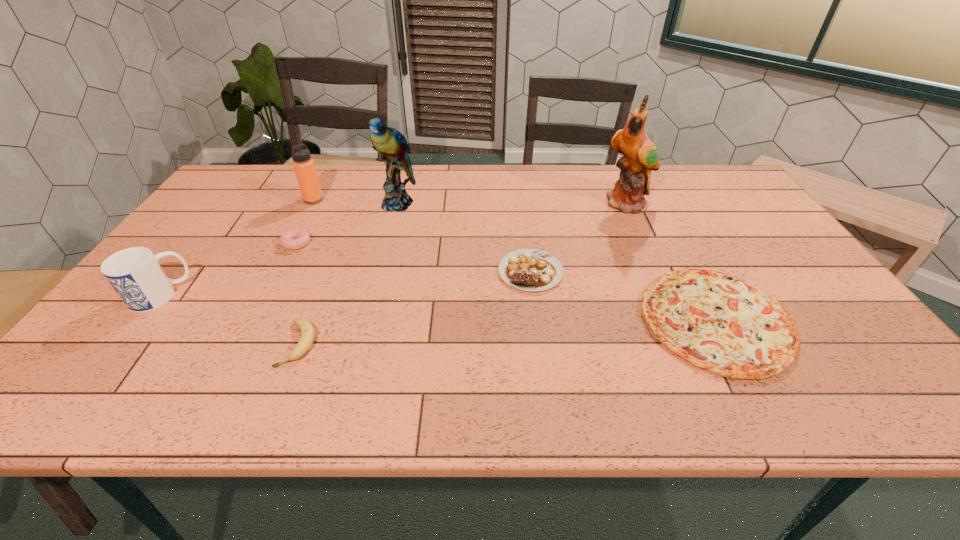
Where is `the taller parrot`? the taller parrot is located at coordinates (640, 156).

Locate an element on the screen. This screenshot has height=540, width=960. the right parrot is located at coordinates (640, 156).

Identify the location of the fourth object from right to left. (392, 146).

Identify the location of the second tallest object. The height and width of the screenshot is (540, 960). (392, 146).

What are the coordinates of `the sixth shortest object` in the screenshot? It's located at (304, 167).

Identify the location of mug. (135, 274).

At what (x,y) coordinates should I click in order to perform the action: click on the leftmost object. Please return your answer as a coordinate pair (x, y). The width and height of the screenshot is (960, 540). Looking at the image, I should click on (135, 274).

Find the location of a particular element. steak is located at coordinates (526, 269).

Where is `doughnut`? doughnut is located at coordinates (293, 239).

Identify the location of the fifth object from right to left. (307, 337).